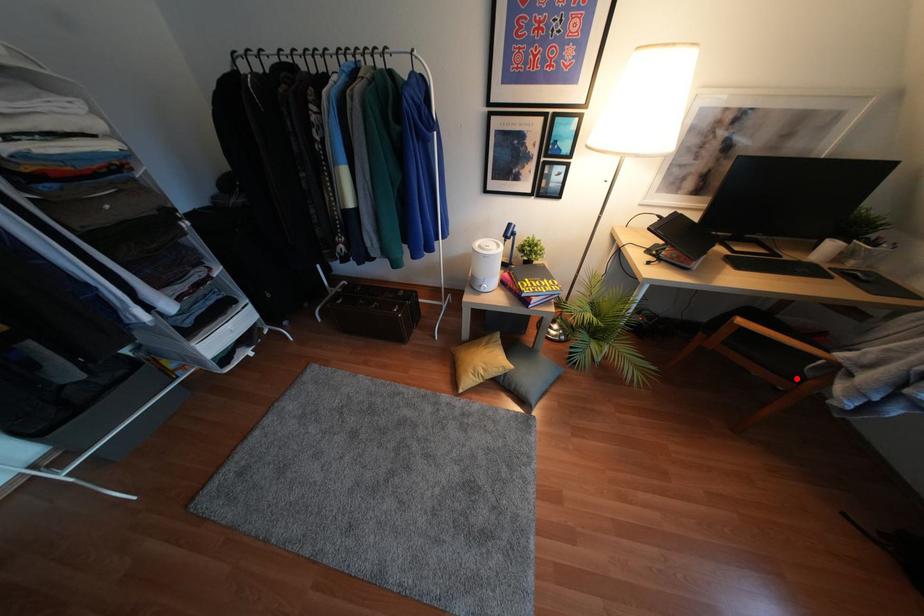
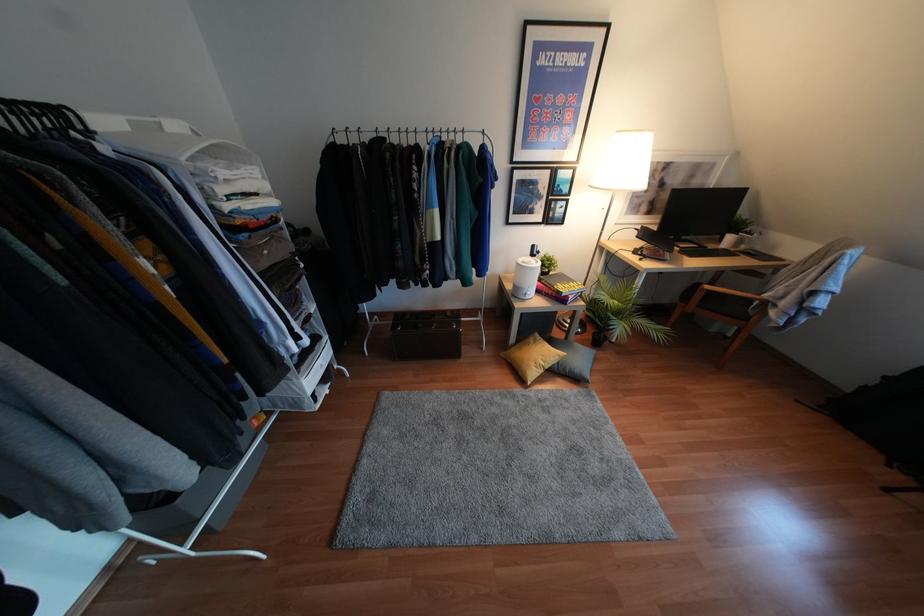
In the second image, find the point that corresponds to the highlighted location in the first image.

(745, 318)